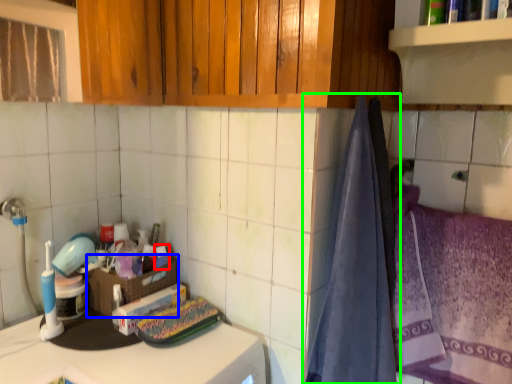
Question: Which is farther away from toiletry (highlighted by a red box)? basket (highlighted by a blue box) or curtain (highlighted by a green box)?

Choices:
 (A) basket
 (B) curtain

Answer: (B)